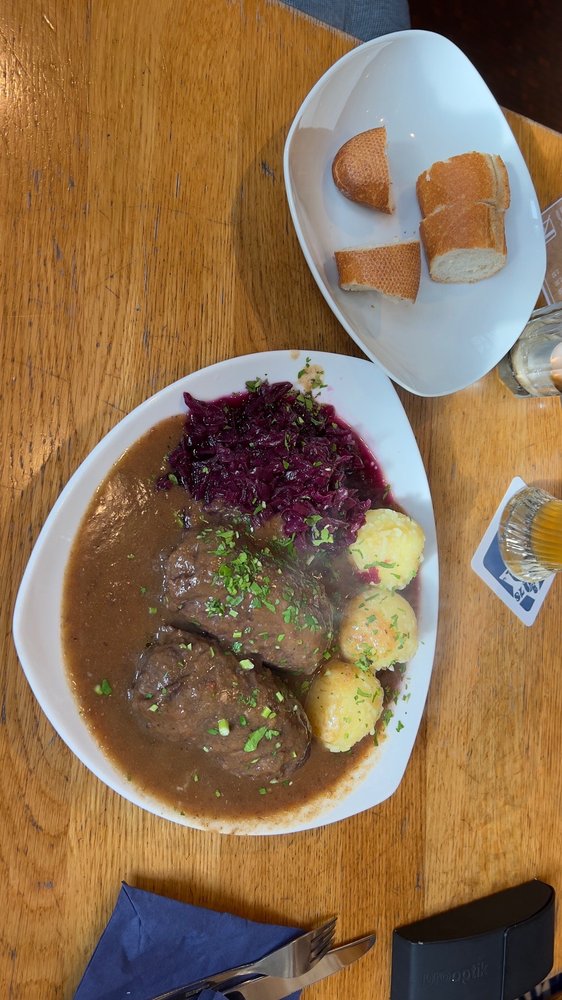
Find the location of a particular element. white dish is located at coordinates (418, 93).